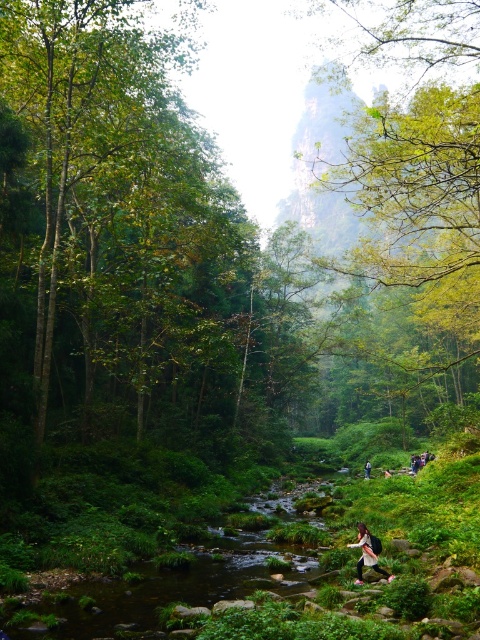
You are a hiker who wants to place a small item in your dark brown leather backpack at lower center while standing on the dark blue jeans at lower center. Can you easily reach the backpack from your current position?

The dark brown leather backpack at lower center is closer to the viewer than the dark blue jeans at lower center, so yes, you can easily reach the backpack from your current position.

You are a hiker carrying a dark brown leather backpack at lower center and you see a fallen log that is 12 meters away from you. Can you safely step onto the log to cross the stream?

The distance between you and the fallen log is 12.36 meters. Since the log is 12 meters away, you can safely step onto it to cross the stream.

You are a hiker who has just arrived at the stream. You have a dark brown leather backpack at lower center and dark blue jeans at lower center. Which item is shorter in height?

The dark brown leather backpack at lower center is not as tall as the dark blue jeans at lower center, so the backpack is shorter in height.